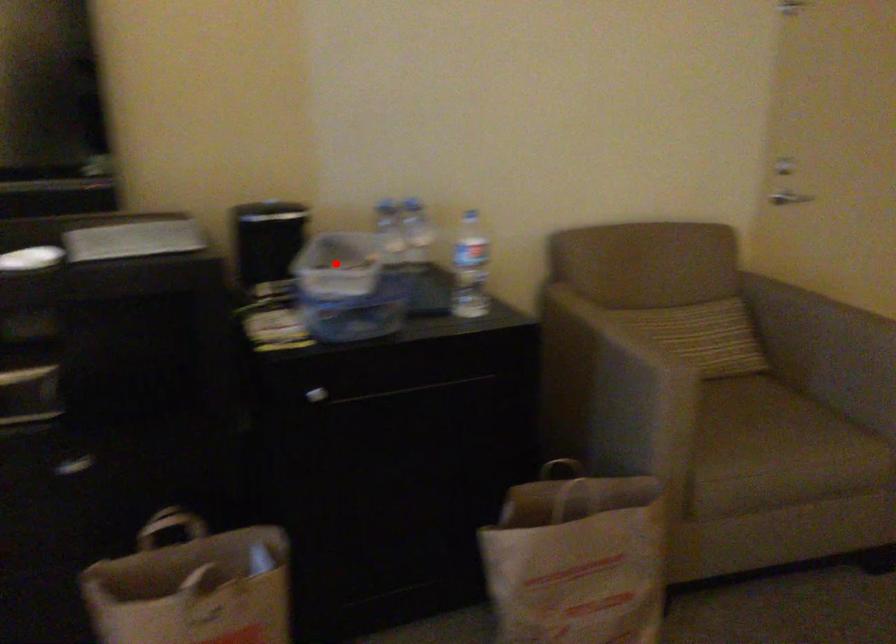
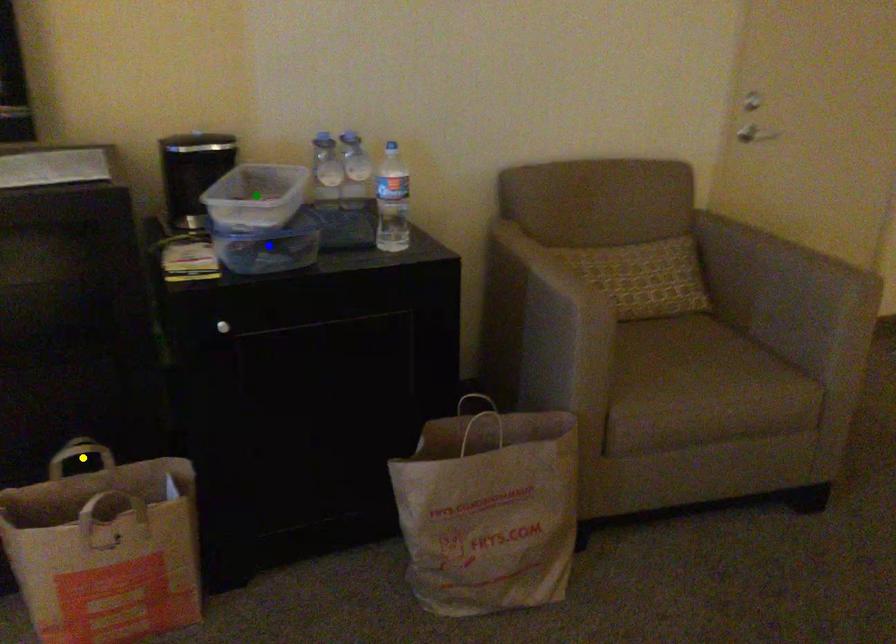
Question: I am providing you with two images of the same scene from different viewpoints. A red point is marked on the first image. You are given multiple points on the second image. Which mark in image 2 goes with the point in image 1?

Choices:
 (A) blue point
 (B) yellow point
 (C) green point

Answer: (C)